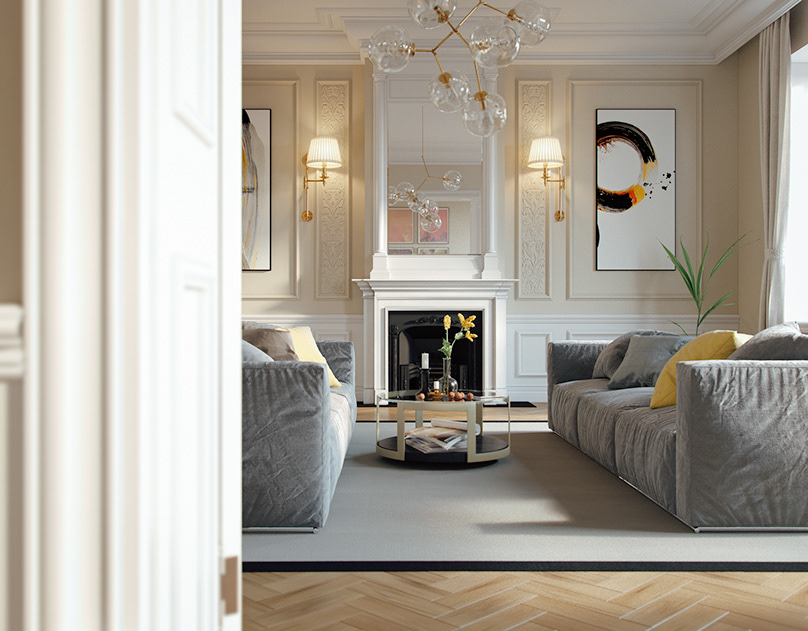
This screenshot has height=631, width=808. I want to click on sconce, so click(x=325, y=149), click(x=553, y=158).